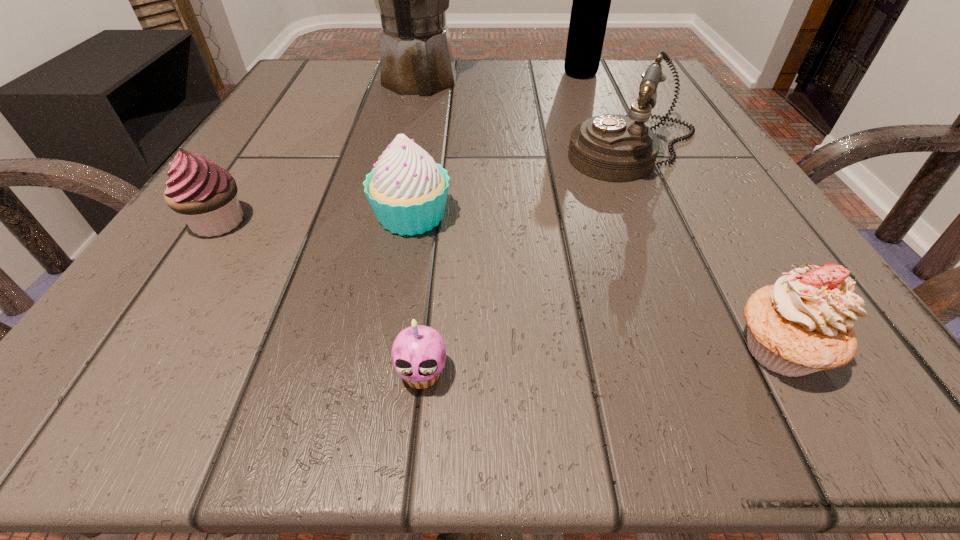
Image resolution: width=960 pixels, height=540 pixels. I want to click on coffeepot, so click(416, 56).

You are a GUI agent. You are given a task and a screenshot of the screen. Output one action in this format:
    pyautogui.click(x=<x>, y=<y>)
    Task: Click on the beer bottle
    
    Given the screenshot: What is the action you would take?
    pyautogui.click(x=590, y=9)

Locate an element on the screen. This screenshot has width=960, height=540. telephone is located at coordinates (616, 148).

Where is `the rightmost cupcake`? The width and height of the screenshot is (960, 540). the rightmost cupcake is located at coordinates (802, 324).

Where is `the leftmost object`? The image size is (960, 540). the leftmost object is located at coordinates (205, 194).

Identify the location of the shortest cupcake. (418, 353).

Where is `vacant region located 0.060m on the left of the beer bottle`? Image resolution: width=960 pixels, height=540 pixels. vacant region located 0.060m on the left of the beer bottle is located at coordinates (534, 74).

At what (x,y) coordinates should I click in order to perform the action: click on vacant space situated on the front of the third farthest object. Please return your answer as a coordinate pair (x, y). Looking at the image, I should click on (706, 296).

The width and height of the screenshot is (960, 540). I want to click on vacant area situated on the left of the rightmost cupcake, so click(x=438, y=349).

At what (x,y) coordinates should I click in order to perform the action: click on free region located on the right of the leftmost cupcake. Please return your answer as a coordinate pair (x, y). Looking at the image, I should click on (348, 222).